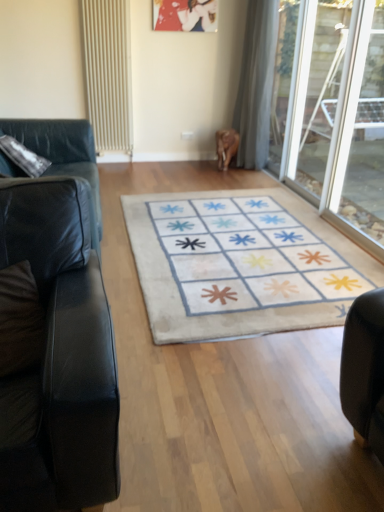
Question: Should I look upward or downward to see metallic silver picture frame at upper center?

Choices:
 (A) up
 (B) down

Answer: (A)

Question: Is metallic silver picture frame at upper center to the left of beige textured radiator at upper left from the viewer's perspective?

Choices:
 (A) yes
 (B) no

Answer: (B)

Question: Considering the relative sizes of metallic silver picture frame at upper center and beige textured radiator at upper left in the image provided, is metallic silver picture frame at upper center shorter than beige textured radiator at upper left?

Choices:
 (A) yes
 (B) no

Answer: (A)

Question: Would you say metallic silver picture frame at upper center contains beige textured radiator at upper left?

Choices:
 (A) no
 (B) yes

Answer: (A)

Question: Is metallic silver picture frame at upper center facing away from beige textured radiator at upper left?

Choices:
 (A) no
 (B) yes

Answer: (A)

Question: From a real-world perspective, does metallic silver picture frame at upper center sit lower than beige textured radiator at upper left?

Choices:
 (A) yes
 (B) no

Answer: (B)

Question: Can you confirm if metallic silver picture frame at upper center is thinner than beige textured radiator at upper left?

Choices:
 (A) yes
 (B) no

Answer: (A)

Question: Considering the relative sizes of beige textured radiator at upper left and white sheer curtain at upper center in the image provided, is beige textured radiator at upper left wider than white sheer curtain at upper center?

Choices:
 (A) no
 (B) yes

Answer: (A)

Question: Does beige textured radiator at upper left contain white sheer curtain at upper center?

Choices:
 (A) yes
 (B) no

Answer: (B)

Question: Does beige textured radiator at upper left lie in front of white sheer curtain at upper center?

Choices:
 (A) yes
 (B) no

Answer: (B)

Question: Does beige textured radiator at upper left appear on the left side of white sheer curtain at upper center?

Choices:
 (A) no
 (B) yes

Answer: (B)

Question: Considering the relative sizes of beige textured radiator at upper left and white sheer curtain at upper center in the image provided, is beige textured radiator at upper left bigger than white sheer curtain at upper center?

Choices:
 (A) yes
 (B) no

Answer: (B)

Question: Is the depth of beige textured radiator at upper left greater than that of white sheer curtain at upper center?

Choices:
 (A) no
 (B) yes

Answer: (B)

Question: Could you tell me if brown suede pillow at left is turned towards transparent glass door at right, which is the 2th glass door in front-to-back order?

Choices:
 (A) yes
 (B) no

Answer: (B)